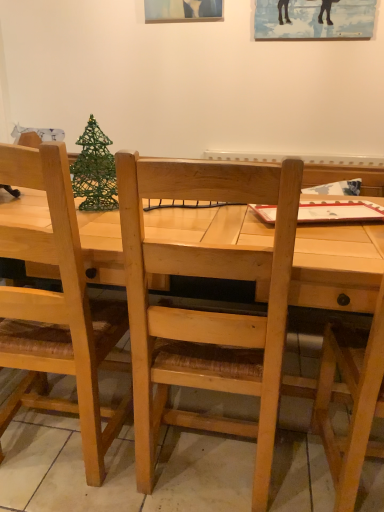
Question: Is natural wood chair at right, which is the first chair from right to left, outside of green wire christmas tree at upper left?

Choices:
 (A) no
 (B) yes

Answer: (B)

Question: Does natural wood chair at right, placed as the 2th chair when sorted from left to right, have a greater height compared to green wire christmas tree at upper left?

Choices:
 (A) yes
 (B) no

Answer: (A)

Question: From a real-world perspective, is natural wood chair at right, placed as the 2th chair when sorted from left to right, positioned under green wire christmas tree at upper left based on gravity?

Choices:
 (A) no
 (B) yes

Answer: (B)

Question: Is natural wood chair at right, which is the first chair from right to left, positioned behind green wire christmas tree at upper left?

Choices:
 (A) yes
 (B) no

Answer: (B)

Question: From the image's perspective, is natural wood chair at right, which is the first chair from right to left, located beneath green wire christmas tree at upper left?

Choices:
 (A) no
 (B) yes

Answer: (B)

Question: Does point [x=294, y=20] appear closer or farther from the camera than point [x=59, y=462]?

Choices:
 (A) farther
 (B) closer

Answer: (A)

Question: From a real-world perspective, relative to light wood table at center, is wooden picture frame at upper center vertically above or below?

Choices:
 (A) below
 (B) above

Answer: (B)

Question: Is wooden picture frame at upper center inside the boundaries of light wood table at center, or outside?

Choices:
 (A) outside
 (B) inside

Answer: (A)

Question: Is wooden picture frame at upper center in front of or behind light wood table at center in the image?

Choices:
 (A) behind
 (B) front

Answer: (A)

Question: Visually, is natural wood chair at left, the 1th chair from the left, positioned to the left or to the right of green wire christmas tree at upper left?

Choices:
 (A) right
 (B) left

Answer: (B)

Question: Considering the positions of natural wood chair at left, which is the second chair from right to left, and green wire christmas tree at upper left in the image, is natural wood chair at left, which is the second chair from right to left, taller or shorter than green wire christmas tree at upper left?

Choices:
 (A) tall
 (B) short

Answer: (A)

Question: Is natural wood chair at left, the 1th chair from the left, wider or thinner than green wire christmas tree at upper left?

Choices:
 (A) wide
 (B) thin

Answer: (A)

Question: Considering the positions of natural wood chair at left, which is the second chair from right to left, and green wire christmas tree at upper left in the image, is natural wood chair at left, which is the second chair from right to left, bigger or smaller than green wire christmas tree at upper left?

Choices:
 (A) small
 (B) big

Answer: (B)

Question: Considering the relative positions of light wood table at center and wooden picture frame at upper center in the image provided, is light wood table at center to the left or to the right of wooden picture frame at upper center?

Choices:
 (A) left
 (B) right

Answer: (A)

Question: Does point (102, 239) appear closer or farther from the camera than point (360, 5)?

Choices:
 (A) closer
 (B) farther

Answer: (A)